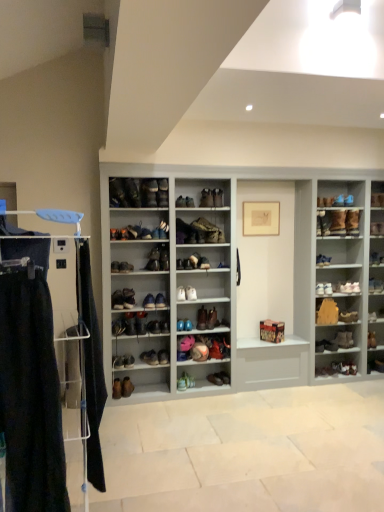
Where is `leather boot at center, the 22th shoe from the right`? Image resolution: width=384 pixels, height=512 pixels. leather boot at center, the 22th shoe from the right is located at coordinates (133, 192).

How much space does matte black shoe at center, marked as the eighth shoe in a left-to-right arrangement, occupy horizontally?

It is 7.56 inches.

Identify the location of dark blue fabric at left. The height and width of the screenshot is (512, 384). (91, 367).

Where is `matte brown shoe at center, which ranks as the 1th shoe in left-to-right order`? This screenshot has height=512, width=384. matte brown shoe at center, which ranks as the 1th shoe in left-to-right order is located at coordinates (115, 267).

In the scene shown: From the image's perspective, is leather sneakers at center, arranged as the second footwear when ordered from the bottom, positioned above or below brown leather shoes at right?

leather sneakers at center, arranged as the second footwear when ordered from the bottom, is situated lower than brown leather shoes at right in the image.

How different are the orientations of leather sneakers at center, marked as the 6th footwear in a top-to-bottom arrangement, and brown leather shoes at right in degrees?

There is a 13.2-degree angle between the facing directions of leather sneakers at center, marked as the 6th footwear in a top-to-bottom arrangement, and brown leather shoes at right.

Based on the photo, from a real-world perspective, which object stands above the other?

brown leather shoes at right is physically above.

Considering the sizes of objects leather sneakers at center, marked as the 6th footwear in a top-to-bottom arrangement, and brown leather shoes at right in the image provided, who is bigger, leather sneakers at center, marked as the 6th footwear in a top-to-bottom arrangement, or brown leather shoes at right?

Bigger between the two is brown leather shoes at right.

Is matte brown boot at center, the 19th shoe positioned from the left, aimed at shiny blue shoe at center, the ninth shoe positioned from the left?

No, matte brown boot at center, the 19th shoe positioned from the left, is not turned towards shiny blue shoe at center, the ninth shoe positioned from the left.

Measure the distance from matte brown boot at center, the 19th shoe positioned from the left, to shiny blue shoe at center, the ninth shoe positioned from the left.

A distance of 32.65 inches exists between matte brown boot at center, the 19th shoe positioned from the left, and shiny blue shoe at center, the ninth shoe positioned from the left.

Can you confirm if matte brown boot at center, the 19th shoe positioned from the left, is smaller than shiny blue shoe at center, the ninth shoe positioned from the left?

Correct, matte brown boot at center, the 19th shoe positioned from the left, occupies less space than shiny blue shoe at center, the ninth shoe positioned from the left.

Is matte brown boot at center, the 19th shoe positioned from the left, wider or thinner than shiny blue shoe at center, the seventeenth shoe positioned from the right?

matte brown boot at center, the 19th shoe positioned from the left, is thinner than shiny blue shoe at center, the seventeenth shoe positioned from the right.

How many degrees apart are the facing directions of leather boot at center, placed as the 7th footwear when sorted from top to bottom, and matte brown shoe at center, which is the third footwear from bottom to top?

The angular difference between leather boot at center, placed as the 7th footwear when sorted from top to bottom, and matte brown shoe at center, which is the third footwear from bottom to top, is 26.7 degrees.

Looking at their sizes, would you say leather boot at center, marked as the 1th footwear in a bottom-to-top arrangement, is wider or thinner than matte brown shoe at center, which is the third footwear from bottom to top?

Clearly, leather boot at center, marked as the 1th footwear in a bottom-to-top arrangement, has less width compared to matte brown shoe at center, which is the third footwear from bottom to top.

Is leather boot at center, marked as the 1th footwear in a bottom-to-top arrangement, shorter than matte brown shoe at center, which is the third footwear from bottom to top?

Correct, leather boot at center, marked as the 1th footwear in a bottom-to-top arrangement, is not as tall as matte brown shoe at center, which is the third footwear from bottom to top.

Considering the positions of points (229, 378) and (168, 362), is point (229, 378) closer to camera compared to point (168, 362)?

No, (229, 378) is further to viewer.

Does matte black shoe at center, which appears as the 18th shoe when viewed from the right, have a greater width compared to matte brown shoe at center, arranged as the 25th shoe when viewed from the right?

In fact, matte black shoe at center, which appears as the 18th shoe when viewed from the right, might be narrower than matte brown shoe at center, arranged as the 25th shoe when viewed from the right.

Considering the sizes of matte black shoe at center, marked as the eighth shoe in a left-to-right arrangement, and matte brown shoe at center, which ranks as the 1th shoe in left-to-right order, in the image, is matte black shoe at center, marked as the eighth shoe in a left-to-right arrangement, taller or shorter than matte brown shoe at center, which ranks as the 1th shoe in left-to-right order,?

In the image, matte black shoe at center, marked as the eighth shoe in a left-to-right arrangement, appears to be taller than matte brown shoe at center, which ranks as the 1th shoe in left-to-right order.

How different are the orientations of matte black shoe at center, which appears as the 18th shoe when viewed from the right, and matte brown shoe at center, arranged as the 25th shoe when viewed from the right, in degrees?

0.116 degrees separate the facing orientations of matte black shoe at center, which appears as the 18th shoe when viewed from the right, and matte brown shoe at center, arranged as the 25th shoe when viewed from the right.

Is matte black shoe at center, marked as the eighth shoe in a left-to-right arrangement, to the right of matte brown shoe at center, which ranks as the 1th shoe in left-to-right order, from the viewer's perspective?

Correct, you'll find matte black shoe at center, marked as the eighth shoe in a left-to-right arrangement, to the right of matte brown shoe at center, which ranks as the 1th shoe in left-to-right order.

Locate an element on the screen. Image resolution: width=384 pixels, height=512 pixels. the 1st footwear directly beneath the leather boot at center, which is counted as the first footwear, starting from the top (from a real-world perspective) is located at coordinates (193, 262).

Which object is further away from the camera, suede brown boot at center, the sixth footwear when ordered from bottom to top, or leather boot at center, arranged as the seventh footwear when ordered from the bottom?

leather boot at center, arranged as the seventh footwear when ordered from the bottom.

Considering the positions of point (200, 264) and point (200, 228), is point (200, 264) closer or farther from the camera than point (200, 228)?

Clearly, point (200, 264) is closer to the camera than point (200, 228).

Between suede brown boot at center, the sixth footwear when ordered from bottom to top, and leather boot at center, arranged as the seventh footwear when ordered from the bottom, which one has less height?

Standing shorter between the two is suede brown boot at center, the sixth footwear when ordered from bottom to top.

Which object is thinner, matte brown boot at center, the 19th shoe positioned from the left, or shiny brown shoe at center, which appears as the tenth shoe when viewed from the right?

matte brown boot at center, the 19th shoe positioned from the left, is thinner.

Is matte brown boot at center, which is counted as the 7th shoe, starting from the right, oriented towards shiny brown shoe at center, which appears as the tenth shoe when viewed from the right?

No.

From a real-world perspective, which object stands above the other?

shiny brown shoe at center, the sixteenth shoe when ordered from left to right, is physically above.

Looking at this image, is matte brown shoe at center, which ranks as the 1th shoe in left-to-right order, in front of or behind matte brown boot at center, which is counted as the 7th shoe, starting from the right, in the image?

Visually, matte brown shoe at center, which ranks as the 1th shoe in left-to-right order, is located in front of matte brown boot at center, which is counted as the 7th shoe, starting from the right.

Between matte brown shoe at center, arranged as the 25th shoe when viewed from the right, and matte brown boot at center, which is counted as the 7th shoe, starting from the right, which one has smaller width?

matte brown boot at center, which is counted as the 7th shoe, starting from the right, is thinner.

From the image's perspective, is matte brown shoe at center, which ranks as the 1th shoe in left-to-right order, on top of matte brown boot at center, which is counted as the 7th shoe, starting from the right?

Incorrect, from the image's perspective, matte brown shoe at center, which ranks as the 1th shoe in left-to-right order, is lower than matte brown boot at center, which is counted as the 7th shoe, starting from the right.

Where is `cabinet behind the leather sneakers at center, marked as the 6th footwear in a top-to-bottom arrangement`? The image size is (384, 512). cabinet behind the leather sneakers at center, marked as the 6th footwear in a top-to-bottom arrangement is located at coordinates (333, 313).

The width and height of the screenshot is (384, 512). Find the location of `the 10th shoe to the right of the shiny blue shoe at center, the seventeenth shoe positioned from the right, counting from the anchor's position`. the 10th shoe to the right of the shiny blue shoe at center, the seventeenth shoe positioned from the right, counting from the anchor's position is located at coordinates (223, 265).

Considering their positions, is dark blue fabric at left positioned closer to brown suede shoe at right, acting as the 23th shoe starting from the left, than leather boot at center, which is the 15th shoe in left-to-right order?

Based on the image, leather boot at center, which is the 15th shoe in left-to-right order, appears to be nearer to brown suede shoe at right, acting as the 23th shoe starting from the left.

From the image, which object appears to be farther from leather shoe at center, which is the 24th shoe from right to left, dark blue fabric at left or leather boot at center, the 14th shoe viewed from the left?

leather boot at center, the 14th shoe viewed from the left.

Considering their positions, is leather boot at center, placed as the 7th footwear when sorted from top to bottom, positioned closer to matte black shoe at center, marked as the eighth shoe in a left-to-right arrangement, than brown suede boot at upper right, which appears as the fifth shoe when viewed from the right?

brown suede boot at upper right, which appears as the fifth shoe when viewed from the right, is positioned closer to the anchor matte black shoe at center, marked as the eighth shoe in a left-to-right arrangement.

From the image, which object appears to be nearer to dark blue fabric at left, matte brown shoe at center, arranged as the 25th shoe when viewed from the right, or shiny blue shoe at center, the seventeenth shoe positioned from the right?

matte brown shoe at center, arranged as the 25th shoe when viewed from the right, is closer to dark blue fabric at left.

From the image, which object appears to be nearer to shiny blue shoe at center, the ninth shoe positioned from the left, leather shoes at center, which is the 4th footwear from top to bottom, or matte brown shoe at center, arranged as the 25th shoe when viewed from the right?

leather shoes at center, which is the 4th footwear from top to bottom, is closer to shiny blue shoe at center, the ninth shoe positioned from the left.

Based on their spatial positions, is shiny leather sneaker at center, which is the 21th shoe in right-to-left order, or dark blue fabric at left further from suede brown boot at center, marked as the 2th footwear in a top-to-bottom arrangement?

Among the two, dark blue fabric at left is located further to suede brown boot at center, marked as the 2th footwear in a top-to-bottom arrangement.

Based on their spatial positions, is leather boot at center, which is counted as the twelfth shoe, starting from the right, or brown leather shoes at right further from leather boot at center, marked as the 1th footwear in a bottom-to-top arrangement?

brown leather shoes at right lies further to leather boot at center, marked as the 1th footwear in a bottom-to-top arrangement, than the other object.

When comparing their distances from matte black shoe at center, the 23th shoe when ordered from right to left, does dark blue fabric at left or leather shoe at center, marked as the third footwear in a top-to-bottom arrangement, seem closer?

The object closer to matte black shoe at center, the 23th shoe when ordered from right to left, is dark blue fabric at left.

At what (x,y) coordinates should I click in order to perform the action: click on shelf between leather boot at center, acting as the eighteenth shoe starting from the left, and brown suede shoe at right, acting as the 23th shoe starting from the left. Please return your answer as a coordinate pair (x, y). The height and width of the screenshot is (512, 384). Looking at the image, I should click on (237, 279).

Locate an element on the screen. The image size is (384, 512). cabinet between leather boot at center, the 8th shoe when ordered from right to left, and matte brown shoe at center, the 13th shoe viewed from the left, in the vertical direction is located at coordinates (333, 313).

You are a GUI agent. You are given a task and a screenshot of the screen. Output one action in this format:
    pyautogui.click(x=<x>, y=<y>)
    Task: Click on the cabinet between leather boot at center, placed as the 4th shoe when sorted from left to right, and brown suede shoe at lower right, the 22th shoe in the left-to-right sequence, from left to right
    
    Given the screenshot: What is the action you would take?
    [x=333, y=313]

At what (x,y) coordinates should I click in order to perform the action: click on cabinet situated between white leather shoe at center, positioned as the eleventh shoe in left-to-right order, and shiny blue shoe at center right, positioned as the sixth shoe in right-to-left order, from left to right. Please return your answer as a coordinate pair (x, y). Looking at the image, I should click on (333, 313).